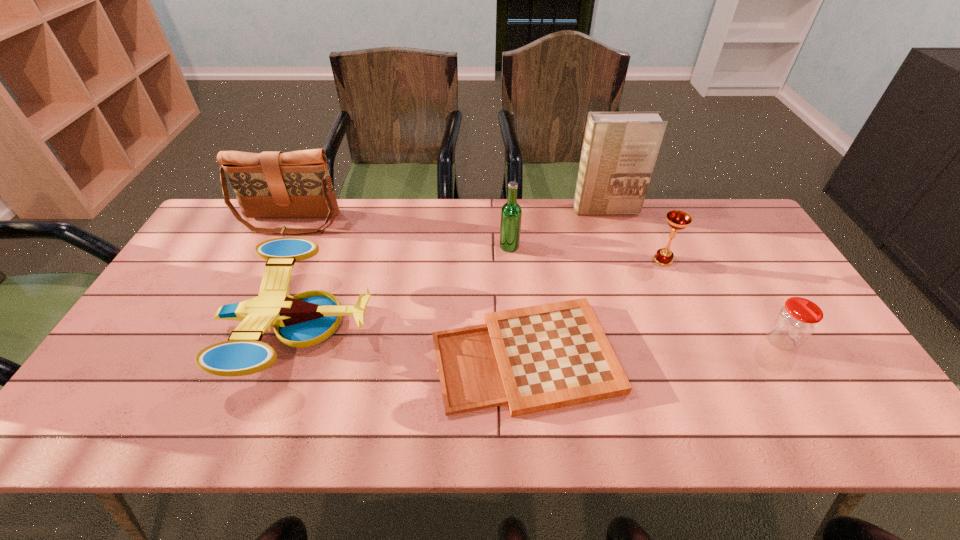
I want to click on object located at the right edge, so click(795, 321).

Locate an element on the screen. The width and height of the screenshot is (960, 540). object situated at the far left corner is located at coordinates (272, 184).

The height and width of the screenshot is (540, 960). In the image, there is a desktop. In order to click on free region at the far edge in this screenshot , I will do coord(602,219).

The width and height of the screenshot is (960, 540). In the image, there is a desktop. Identify the location of vacant space at the near edge. (768, 411).

Locate an element on the screen. This screenshot has width=960, height=540. free space at the left edge of the desktop is located at coordinates (170, 325).

Identify the location of vacant space at the right edge. The height and width of the screenshot is (540, 960). (745, 284).

Where is `vacant area at the near left corner of the desktop`? The height and width of the screenshot is (540, 960). vacant area at the near left corner of the desktop is located at coordinates (125, 429).

Find the location of a particular element. vacant space at the far right corner is located at coordinates (718, 230).

Identify the location of free space between the tallest object and the fourth tallest object. (634, 235).

You are a GUI agent. You are given a task and a screenshot of the screen. Output one action in this format:
    pyautogui.click(x=<x>, y=<y>)
    Task: Click on the free space between the beer bottle and the shoulder bag
    
    Given the screenshot: What is the action you would take?
    pyautogui.click(x=400, y=234)